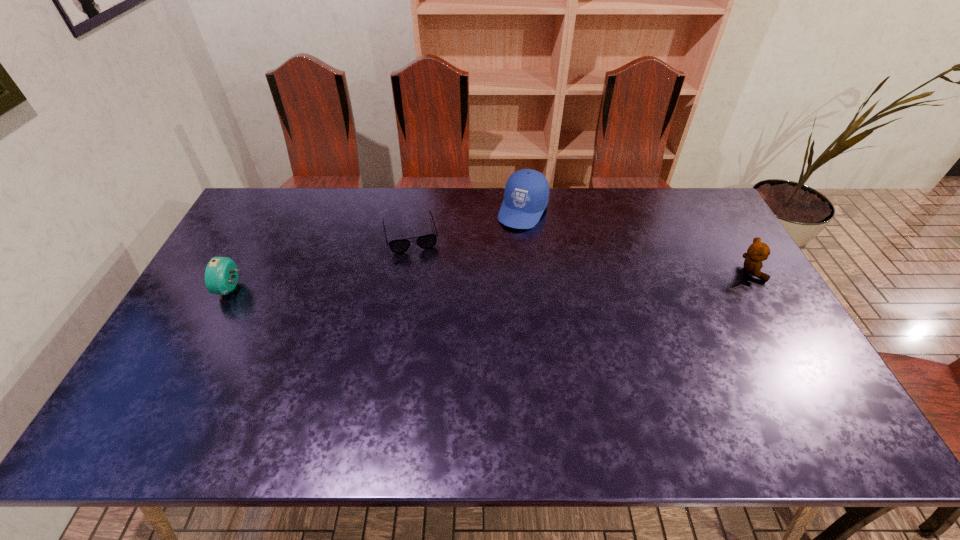
I want to click on vacant area situated 0.170m on the front-facing side of the third object from right to left, so click(423, 292).

Locate an element on the screen. Image resolution: width=960 pixels, height=540 pixels. cap that is at the far edge is located at coordinates (526, 194).

Locate an element on the screen. The height and width of the screenshot is (540, 960). spectacles present at the far edge is located at coordinates (428, 241).

The image size is (960, 540). What are the coordinates of `object that is at the left edge` in the screenshot? It's located at (221, 275).

Where is `object that is at the right edge`? This screenshot has height=540, width=960. object that is at the right edge is located at coordinates (758, 251).

I want to click on vacant position at the far edge of the desktop, so click(x=543, y=227).

The image size is (960, 540). In the image, there is a desktop. In order to click on vacant space at the near edge in this screenshot , I will do `click(396, 399)`.

This screenshot has height=540, width=960. I want to click on vacant region at the left edge of the desktop, so click(272, 249).

In the image, there is a desktop. Where is `free space at the right edge`? The height and width of the screenshot is (540, 960). free space at the right edge is located at coordinates (754, 357).

The image size is (960, 540). Find the location of `free point at the far left corner`. free point at the far left corner is located at coordinates (282, 190).